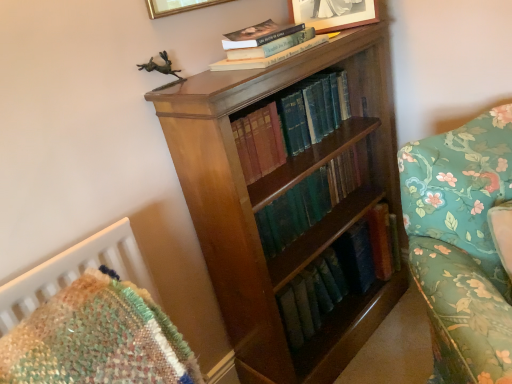
Identify the location of green leather book at center, the second book when ordered from top to bottom. This screenshot has height=384, width=512. (291, 122).

Describe the element at coordinates (333, 13) in the screenshot. The image size is (512, 384). I see `matte silver picture frame at upper center, which is the 2th picture frame in left-to-right order` at that location.

Locate an element on the screen. This screenshot has width=512, height=384. hardcover book at upper center, which ranks as the first book in top-to-bottom order is located at coordinates (264, 56).

At what (x,y) coordinates should I click in order to perform the action: click on shiny brown wood bookcase at center. Please return your answer as a coordinate pair (x, y). The width and height of the screenshot is (512, 384). Looking at the image, I should click on click(283, 194).

Find the location of a particular element. The image size is (512, 384). green leather book at center, which is counted as the 2th book, starting from the bottom is located at coordinates (291, 122).

How distant is matte silver picture frame at upper center, which is the 2th picture frame in left-to-right order, from shiny brown wood bookcase at center?

The distance of matte silver picture frame at upper center, which is the 2th picture frame in left-to-right order, from shiny brown wood bookcase at center is 21.39 inches.

Looking at this image, do you think matte silver picture frame at upper center, which is the 2th picture frame in left-to-right order, is within shiny brown wood bookcase at center, or outside of it?

matte silver picture frame at upper center, which is the 2th picture frame in left-to-right order, is not enclosed by shiny brown wood bookcase at center.

Find the location of a particular element. the 1st picture frame above when counting from the shiny brown wood bookcase at center (from the image's perspective) is located at coordinates (333, 13).

Does point (315, 10) appear closer or farther from the camera than point (383, 71)?

Point (315, 10).

Between hardcover book at upper center, which ranks as the first book in top-to-bottom order, and gold metallic picture frame at upper center, the 2th picture frame viewed from the right, which one has smaller size?

hardcover book at upper center, which ranks as the first book in top-to-bottom order, is smaller.

Is hardcover book at upper center, which ranks as the first book in top-to-bottom order, touching gold metallic picture frame at upper center, the 2th picture frame viewed from the right?

No, hardcover book at upper center, which ranks as the first book in top-to-bottom order, is not with gold metallic picture frame at upper center, the 2th picture frame viewed from the right.

Does hardcover book at upper center, marked as the third book in a bottom-to-top arrangement, come behind gold metallic picture frame at upper center, arranged as the 1th picture frame when viewed from the left?

Yes.

Would you say hardcover book at upper center, which ranks as the first book in top-to-bottom order, contains gold metallic picture frame at upper center, the 2th picture frame viewed from the right?

No, gold metallic picture frame at upper center, the 2th picture frame viewed from the right, is not surrounded by hardcover book at upper center, which ranks as the first book in top-to-bottom order.

From a real-world perspective, who is located lower, gold metallic picture frame at upper center, arranged as the 1th picture frame when viewed from the left, or shiny brown wood bookcase at center?

shiny brown wood bookcase at center is physically lower.

Considering the relative positions of gold metallic picture frame at upper center, arranged as the 1th picture frame when viewed from the left, and shiny brown wood bookcase at center in the image provided, is gold metallic picture frame at upper center, arranged as the 1th picture frame when viewed from the left, to the left of shiny brown wood bookcase at center from the viewer's perspective?

Yes, gold metallic picture frame at upper center, arranged as the 1th picture frame when viewed from the left, is to the left of shiny brown wood bookcase at center.

Would you say gold metallic picture frame at upper center, arranged as the 1th picture frame when viewed from the left, is outside shiny brown wood bookcase at center?

Yes, gold metallic picture frame at upper center, arranged as the 1th picture frame when viewed from the left, is located beyond the bounds of shiny brown wood bookcase at center.

From a real-world perspective, which picture frame is the 2nd one above the green leather book at center, the first book from the bottom? Please provide its 2D coordinates.

[(177, 6)]

Is gold metallic picture frame at upper center, the 2th picture frame viewed from the right, closer to the viewer compared to green leather book at center, the 3th book from the top?

Yes, gold metallic picture frame at upper center, the 2th picture frame viewed from the right, is closer to the viewer.

Considering the sizes of gold metallic picture frame at upper center, the 2th picture frame viewed from the right, and green leather book at center, the 3th book from the top, in the image, is gold metallic picture frame at upper center, the 2th picture frame viewed from the right, bigger or smaller than green leather book at center, the 3th book from the top,?

Clearly, gold metallic picture frame at upper center, the 2th picture frame viewed from the right, is smaller in size than green leather book at center, the 3th book from the top.

Is gold metallic picture frame at upper center, the 2th picture frame viewed from the right, positioned with its back to green leather book at center, the first book from the bottom?

That's not correct — gold metallic picture frame at upper center, the 2th picture frame viewed from the right, is not looking away from green leather book at center, the first book from the bottom.

Is green leather book at center, the 3th book from the top, thinner than matte silver picture frame at upper center, which is the 2th picture frame in left-to-right order?

No.

Between green leather book at center, the first book from the bottom, and matte silver picture frame at upper center, the 1th picture frame positioned from the right, which one has more height?

matte silver picture frame at upper center, the 1th picture frame positioned from the right.

Considering the positions of objects green leather book at center, the 3th book from the top, and matte silver picture frame at upper center, which is the 2th picture frame in left-to-right order, in the image provided, who is more to the left, green leather book at center, the 3th book from the top, or matte silver picture frame at upper center, which is the 2th picture frame in left-to-right order,?

green leather book at center, the 3th book from the top, is more to the left.

Is green leather book at center, the first book from the bottom, completely or partially outside of matte silver picture frame at upper center, the 1th picture frame positioned from the right?

Indeed, green leather book at center, the first book from the bottom, is completely outside matte silver picture frame at upper center, the 1th picture frame positioned from the right.

In the image, is floral fabric couch at right positioned in front of or behind shiny brown wood bookcase at center?

Visually, floral fabric couch at right is located in front of shiny brown wood bookcase at center.

Is point (484, 338) closer to camera compared to point (240, 363)?

Yes.

Can you confirm if floral fabric couch at right is shorter than shiny brown wood bookcase at center?

Yes.

Is floral fabric couch at right wider than shiny brown wood bookcase at center?

Indeed, floral fabric couch at right has a greater width compared to shiny brown wood bookcase at center.

Considering the sizes of objects matte silver picture frame at upper center, the 1th picture frame positioned from the right, and hardcover book at upper center, marked as the third book in a bottom-to-top arrangement, in the image provided, who is smaller, matte silver picture frame at upper center, the 1th picture frame positioned from the right, or hardcover book at upper center, marked as the third book in a bottom-to-top arrangement,?

hardcover book at upper center, marked as the third book in a bottom-to-top arrangement.

Between matte silver picture frame at upper center, which is the 2th picture frame in left-to-right order, and hardcover book at upper center, marked as the third book in a bottom-to-top arrangement, which one has smaller width?

matte silver picture frame at upper center, which is the 2th picture frame in left-to-right order.

You are a GUI agent. You are given a task and a screenshot of the screen. Output one action in this format:
    pyautogui.click(x=<x>, y=<y>)
    Task: Click on the picture frame that is the 1st object located above the hardcover book at upper center, which ranks as the first book in top-to-bottom order (from the image's perspective)
    Image resolution: width=512 pixels, height=384 pixels.
    Given the screenshot: What is the action you would take?
    pyautogui.click(x=333, y=13)

In terms of height, does matte silver picture frame at upper center, the 1th picture frame positioned from the right, look taller or shorter compared to hardcover book at upper center, which ranks as the first book in top-to-bottom order?

In the image, matte silver picture frame at upper center, the 1th picture frame positioned from the right, appears to be taller than hardcover book at upper center, which ranks as the first book in top-to-bottom order.

Where is `bookcase in front of the matte silver picture frame at upper center, the 1th picture frame positioned from the right`? Image resolution: width=512 pixels, height=384 pixels. bookcase in front of the matte silver picture frame at upper center, the 1th picture frame positioned from the right is located at coordinates (283, 194).

The height and width of the screenshot is (384, 512). Find the location of `the 1st book positioned below the gold metallic picture frame at upper center, the 2th picture frame viewed from the right (from the image's perspective)`. the 1st book positioned below the gold metallic picture frame at upper center, the 2th picture frame viewed from the right (from the image's perspective) is located at coordinates (264, 56).

Based on their spatial positions, is matte silver picture frame at upper center, the 1th picture frame positioned from the right, or gold metallic picture frame at upper center, the 2th picture frame viewed from the right, further from green leather book at center, which is counted as the 2th book, starting from the bottom?

gold metallic picture frame at upper center, the 2th picture frame viewed from the right.

When comparing their distances from shiny brown wood bookcase at center, does floral fabric couch at right or matte silver picture frame at upper center, which is the 2th picture frame in left-to-right order, seem further?

matte silver picture frame at upper center, which is the 2th picture frame in left-to-right order.

From the image, which object appears to be farther from green leather book at center, the first book from the bottom, floral fabric couch at right or matte silver picture frame at upper center, which is the 2th picture frame in left-to-right order?

matte silver picture frame at upper center, which is the 2th picture frame in left-to-right order.

When comparing their distances from shiny brown wood bookcase at center, does hardcover book at upper center, which ranks as the first book in top-to-bottom order, or floral fabric couch at right seem closer?

floral fabric couch at right.

When comparing their distances from shiny brown wood bookcase at center, does green leather book at center, the 3th book from the top, or floral fabric couch at right seem closer?

Based on the image, green leather book at center, the 3th book from the top, appears to be nearer to shiny brown wood bookcase at center.

Which object lies nearer to the anchor point green leather book at center, the first book from the bottom, gold metallic picture frame at upper center, arranged as the 1th picture frame when viewed from the left, or shiny brown wood bookcase at center?

shiny brown wood bookcase at center is positioned closer to the anchor green leather book at center, the first book from the bottom.

Looking at the image, which one is located closer to matte silver picture frame at upper center, which is the 2th picture frame in left-to-right order, green leather book at center, which is counted as the 2th book, starting from the bottom, or green leather book at center, the first book from the bottom?

The object closer to matte silver picture frame at upper center, which is the 2th picture frame in left-to-right order, is green leather book at center, which is counted as the 2th book, starting from the bottom.

Based on their spatial positions, is floral fabric couch at right or green leather book at center, the first book from the bottom, further from green leather book at center, the second book when ordered from top to bottom?

floral fabric couch at right is further to green leather book at center, the second book when ordered from top to bottom.

At what (x,y) coordinates should I click in order to perform the action: click on picture frame between gold metallic picture frame at upper center, arranged as the 1th picture frame when viewed from the left, and green leather book at center, the second book when ordered from top to bottom, from top to bottom. Please return your answer as a coordinate pair (x, y). The height and width of the screenshot is (384, 512). Looking at the image, I should click on (333, 13).

Identify the location of picture frame between gold metallic picture frame at upper center, the 2th picture frame viewed from the right, and shiny brown wood bookcase at center in the up-down direction. (333, 13).

This screenshot has width=512, height=384. Find the location of `bookcase between hardcover book at upper center, which ranks as the first book in top-to-bottom order, and floral fabric couch at right in the up-down direction`. bookcase between hardcover book at upper center, which ranks as the first book in top-to-bottom order, and floral fabric couch at right in the up-down direction is located at coordinates (283, 194).

Where is `bookcase between green leather book at center, which is counted as the 2th book, starting from the bottom, and floral fabric couch at right from left to right`? The width and height of the screenshot is (512, 384). bookcase between green leather book at center, which is counted as the 2th book, starting from the bottom, and floral fabric couch at right from left to right is located at coordinates (283, 194).